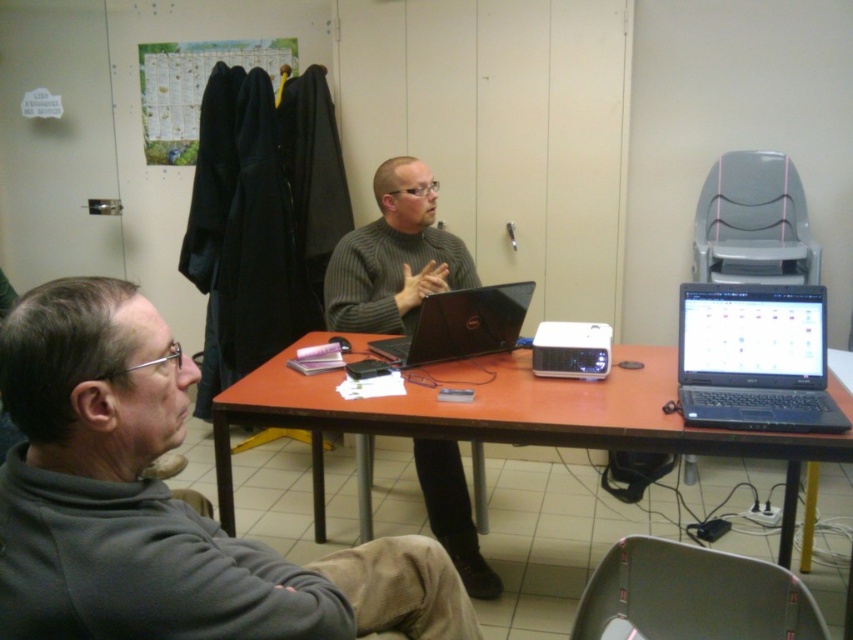
Does gray fleece jacket at lower left appear on the right side of black matte laptop at right?

No, gray fleece jacket at lower left is not to the right of black matte laptop at right.

Identify the location of gray fleece jacket at lower left. The width and height of the screenshot is (853, 640). (160, 502).

Does point (448, 584) lie behind point (819, 400)?

No, (448, 584) is in front of (819, 400).

You are a GUI agent. You are given a task and a screenshot of the screen. Output one action in this format:
    pyautogui.click(x=<x>, y=<y>)
    Task: Click on the gray fleece jacket at lower left
    
    Given the screenshot: What is the action you would take?
    pyautogui.click(x=160, y=502)

Describe the element at coordinates (498, 420) in the screenshot. Image resolution: width=853 pixels, height=640 pixels. I see `brown wooden table at center` at that location.

Does brown wooden table at center come in front of knitted sweater at center?

Yes, brown wooden table at center is closer to the viewer.

This screenshot has width=853, height=640. In order to click on brown wooden table at center in this screenshot , I will do `click(498, 420)`.

Does knitted sweater at center lie in front of dull black laptop at center?

No.

Describe the element at coordinates (393, 257) in the screenshot. I see `knitted sweater at center` at that location.

Where is `knitted sweater at center`? This screenshot has width=853, height=640. knitted sweater at center is located at coordinates (393, 257).